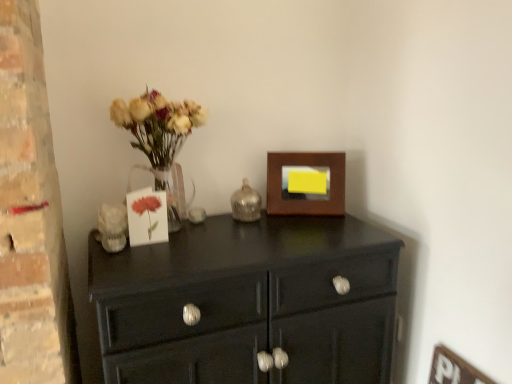
This screenshot has width=512, height=384. Find the location of `free space in front of shiny metallic candle holder at center`. free space in front of shiny metallic candle holder at center is located at coordinates (237, 228).